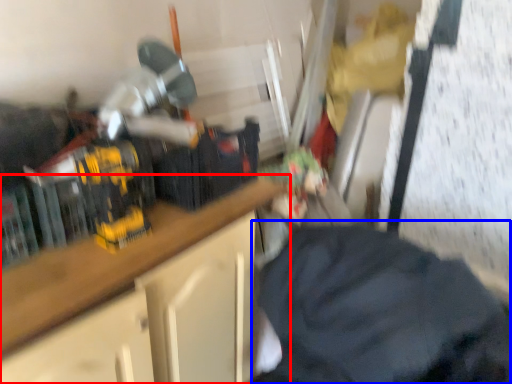
Question: Among these objects, which one is nearest to the camera, cabinetry (highlighted by a red box) or clothing (highlighted by a blue box)?

Choices:
 (A) cabinetry
 (B) clothing

Answer: (B)